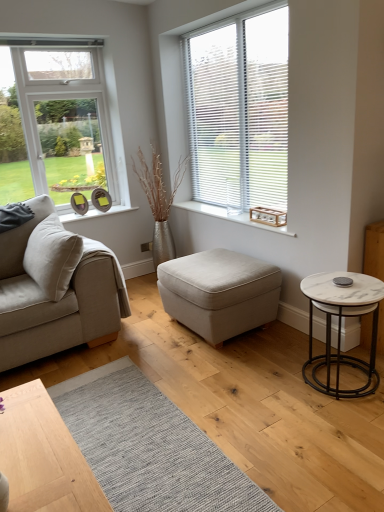
This screenshot has height=512, width=384. I want to click on vacant space behind white marble side table at right, so pyautogui.click(x=292, y=347).